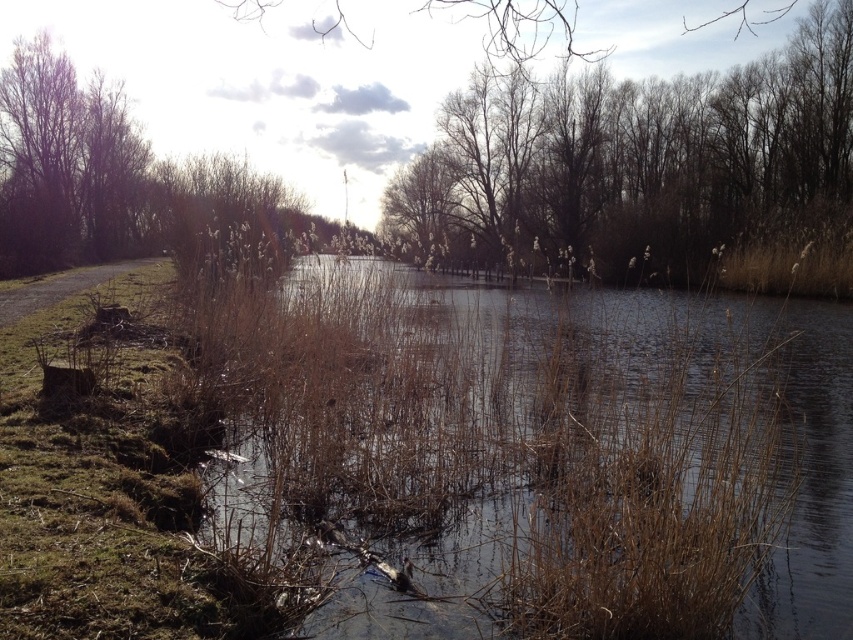
You are a photographer standing at the edge of the water. You want to capture a closeup shot of the bare branches at upper center. Given that your camera can focus on objects within 10 meters, will you be able to take the photo without moving closer?

The bare branches at upper center is 11.60 meters from the camera, which is beyond the 10 meters focus range. Therefore, you cannot take the closeup shot without moving closer.

You are an artist sketching the scene and want to draw the two sets of branches. Which of the two, the bare branches at upper center or the brown bare branches at upper left, should you draw larger in your sketch?

You should draw the bare branches at upper center larger in your sketch because the bare branches at upper center is larger in size than brown bare branches at upper left.

You are an artist sketching the scene and want to ensure accurate proportions. Which of the two objects, the bare branches at upper center or the brown bare branches at upper left, should you draw wider in your sketch?

The bare branches at upper center should be drawn wider in your sketch because their width surpasses that of the brown bare branches at upper left.